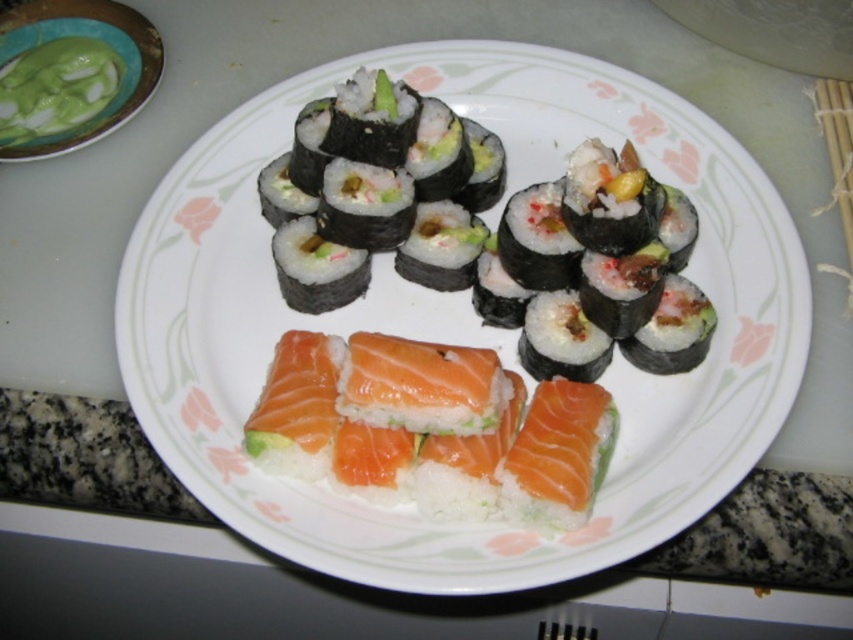
You are a food critic evaluating the presentation of this dish. Based on the image, which object, the white glossy plate at center or the green matte bowl at upper left, is positioned higher in terms of vertical height?

The white glossy plate at center is much taller than the green matte bowl at upper left, so it is positioned higher in terms of vertical height.